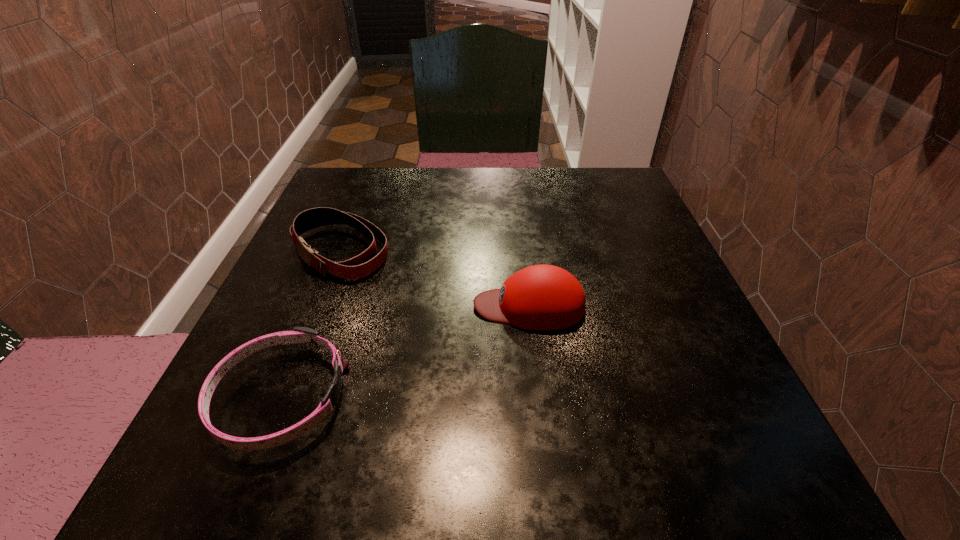
Where is `the rightmost object`? This screenshot has width=960, height=540. the rightmost object is located at coordinates [x=542, y=297].

What are the coordinates of `baseball cap` in the screenshot? It's located at (x=542, y=297).

In order to click on the farther dog collar in this screenshot , I will do `click(362, 265)`.

Locate an element on the screen. This screenshot has width=960, height=540. the farthest object is located at coordinates (362, 265).

Where is `the nearer dog collar`? the nearer dog collar is located at coordinates (299, 334).

Locate an element on the screen. This screenshot has height=540, width=960. the shorter dog collar is located at coordinates (299, 334).

The image size is (960, 540). Identify the location of vacant space positioned 0.280m on the front-facing side of the second farthest object. (314, 306).

Where is `free location located 0.070m on the front-facing side of the second farthest object`? The height and width of the screenshot is (540, 960). free location located 0.070m on the front-facing side of the second farthest object is located at coordinates (434, 306).

Locate an element on the screen. vacant area located 0.180m on the front-facing side of the second farthest object is located at coordinates (371, 306).

Locate an element on the screen. vacant point located on the front of the farthest object is located at coordinates click(251, 481).